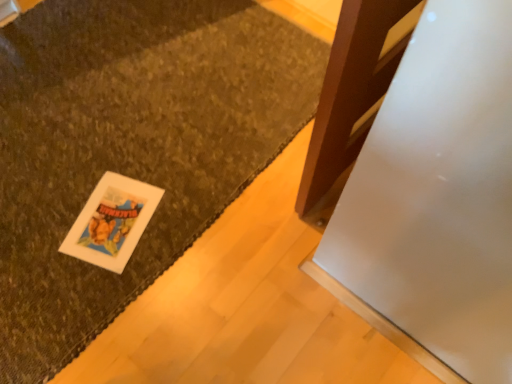
Where is `vacant point above white matte card at lower left (from a real-world perspective)`? This screenshot has width=512, height=384. vacant point above white matte card at lower left (from a real-world perspective) is located at coordinates (113, 218).